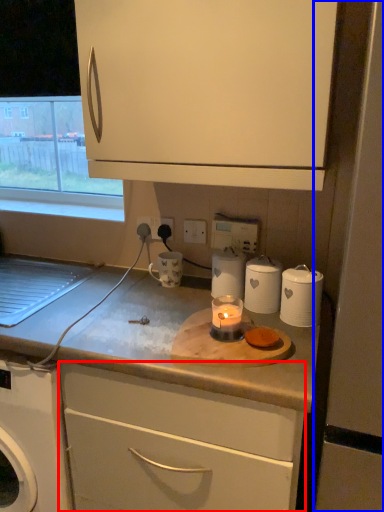
Question: Which object appears closest to the camera in this image, cabinetry (highlighted by a red box) or screen door (highlighted by a blue box)?

Choices:
 (A) cabinetry
 (B) screen door

Answer: (B)